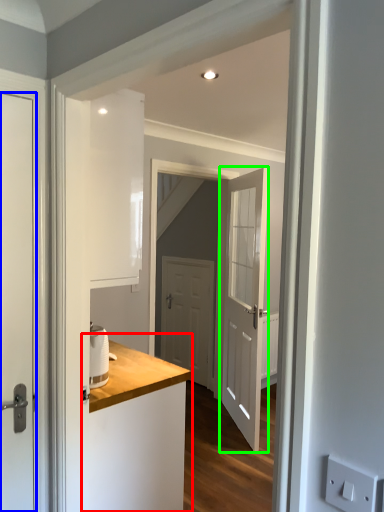
Question: Which object is positioned closest to counter (highlighted by a red box)? Select from door (highlighted by a blue box) and door (highlighted by a green box).

Choices:
 (A) door
 (B) door

Answer: (A)